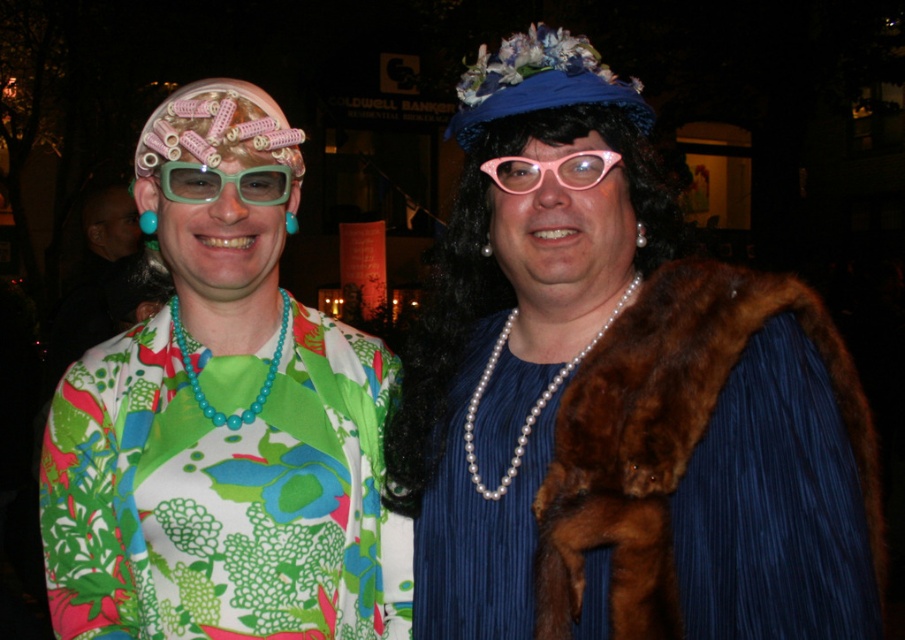
You are at a costume party and need to decide which item to take with you. You can only carry one. The brown fur coat at right is much taller than the matte green plastic goggles at upper left. Which item takes up more vertical space?

The brown fur coat at right takes up more vertical space because it is much taller than the matte green plastic goggles at upper left.

You are organizing a fashion show and need to decide which coat to display first. The pearl necklace fur coat at center and the brown fur coat at right are both contenders. Based on their sizes, which one should you choose to showcase first if you want to start with the larger piece?

The pearl necklace fur coat at center should be displayed first since its width is larger than the brown fur coat at right, making it the bigger option to start the show with.